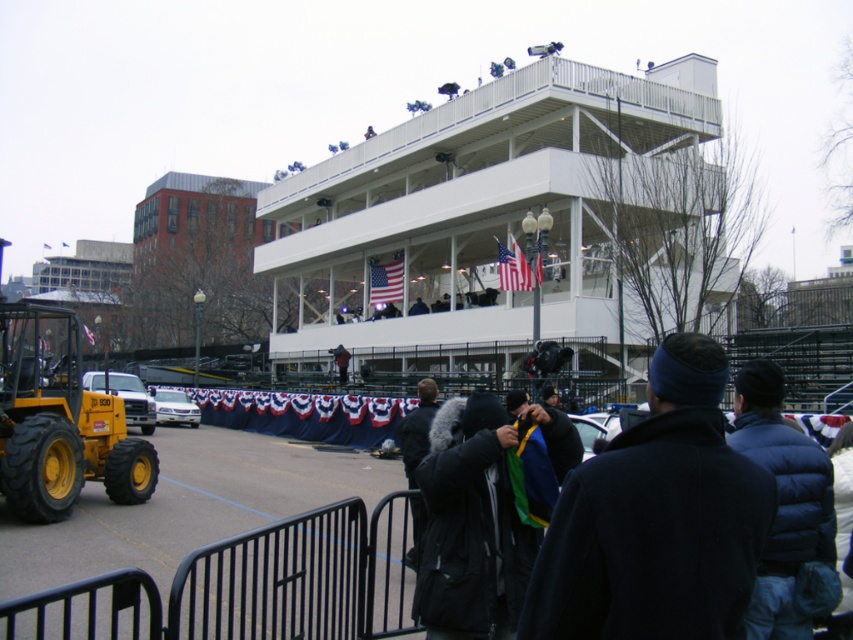
Does dark blue puffer jacket at lower right appear under black fur-lined coat at center?

Actually, dark blue puffer jacket at lower right is above black fur-lined coat at center.

Consider the image. Is the position of dark blue puffer jacket at lower right more distant than that of black fur-lined coat at center?

No, it is in front of black fur-lined coat at center.

Where is `dark blue puffer jacket at lower right`? dark blue puffer jacket at lower right is located at coordinates (782, 502).

Does dark blue fleece jacket at center appear on the left side of black fur-lined coat at center?

In fact, dark blue fleece jacket at center is to the right of black fur-lined coat at center.

Is point (656, 413) behind point (427, 400)?

No, (656, 413) is closer to viewer.

You are a GUI agent. You are given a task and a screenshot of the screen. Output one action in this format:
    pyautogui.click(x=<x>, y=<y>)
    Task: Click on the dark blue fleece jacket at center
    Image resolution: width=853 pixels, height=640 pixels.
    Given the screenshot: What is the action you would take?
    pyautogui.click(x=656, y=518)

Where is `dark blue fleece jacket at center`? This screenshot has height=640, width=853. dark blue fleece jacket at center is located at coordinates (656, 518).

Is yellow rubber tractor at lower left positioned before black fur-lined coat at center?

No, it is not.

Describe the element at coordinates (59, 420) in the screenshot. I see `yellow rubber tractor at lower left` at that location.

Locate an element on the screen. The image size is (853, 640). yellow rubber tractor at lower left is located at coordinates (59, 420).